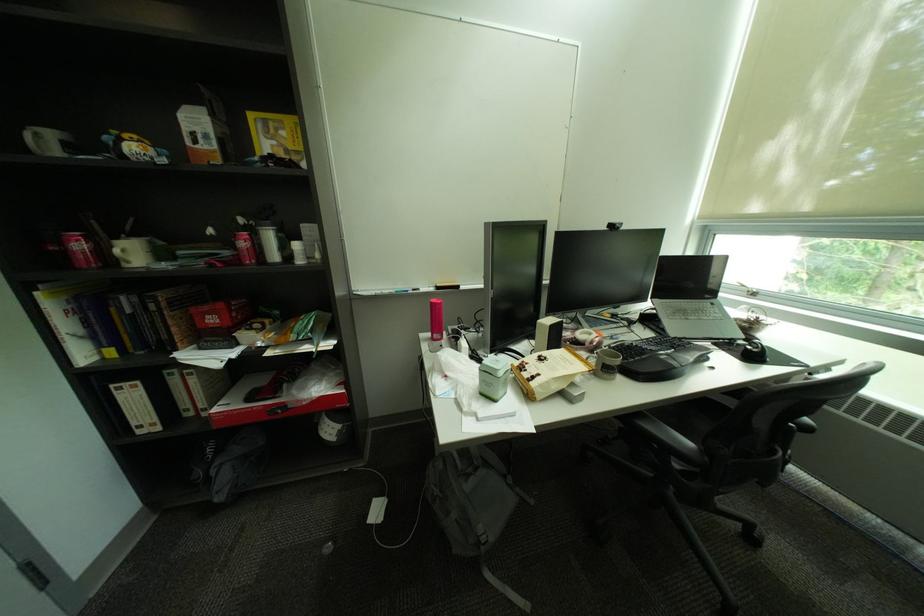
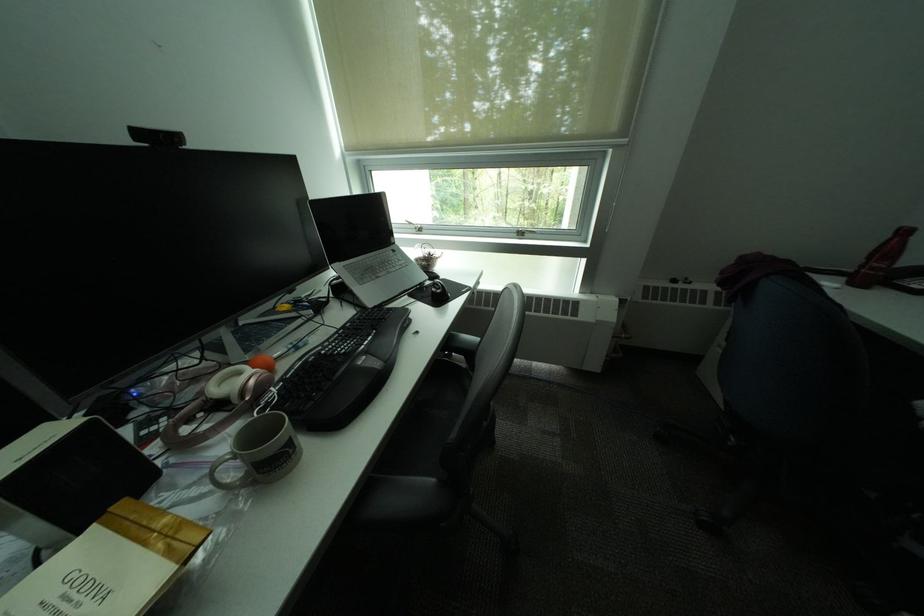
The first image is from the beginning of the video and the second image is from the end. How did the camera likely rotate when shooting the video?

The camera's rotation is toward right-down.